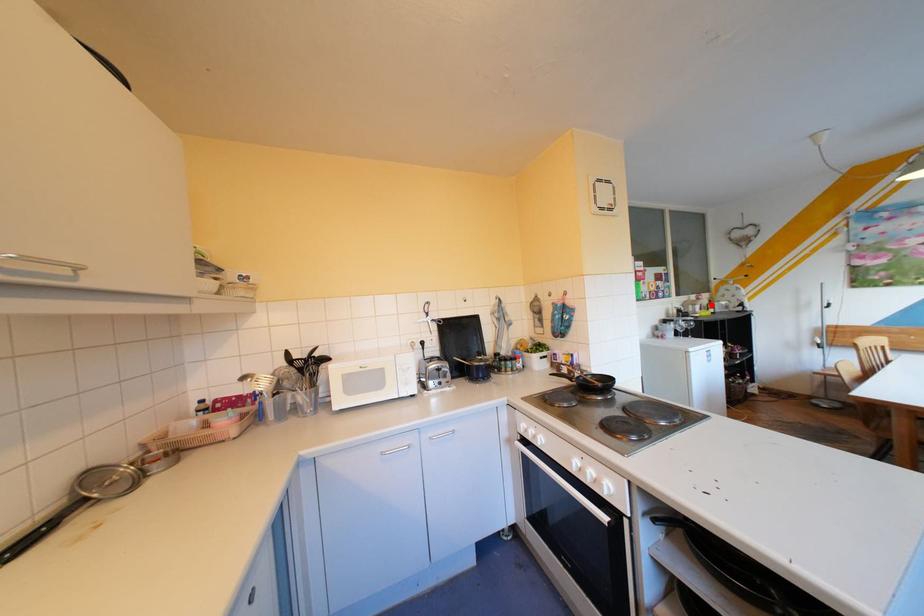
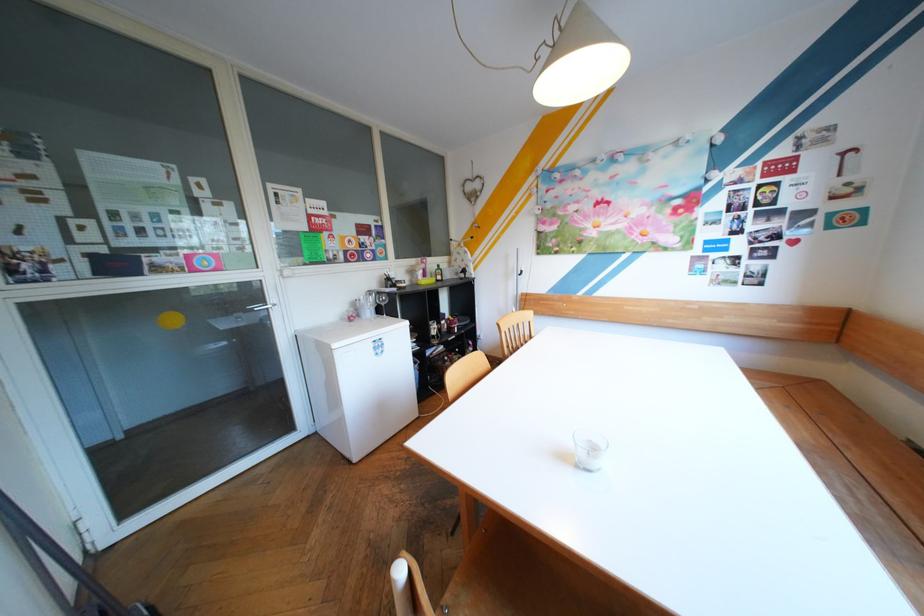
Question: I am providing you with two images of the same scene from different viewpoints. A red point is marked on the first image. Is the red point's position out of view in image 2?

Choices:
 (A) Yes
 (B) No

Answer: (B)